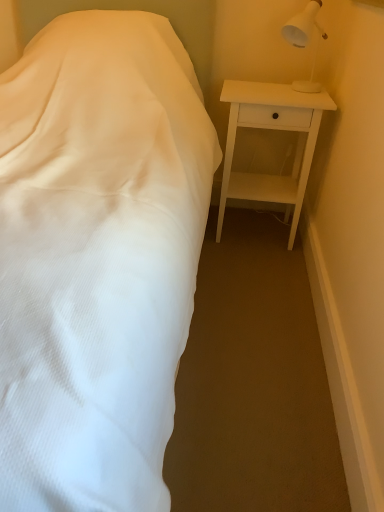
Question: Is white plastic lamp at upper right spatially inside white matte nightstand at right, or outside of it?

Choices:
 (A) outside
 (B) inside

Answer: (A)

Question: From a real-world perspective, relative to white matte nightstand at right, is white plastic lamp at upper right vertically above or below?

Choices:
 (A) above
 (B) below

Answer: (A)

Question: From the image's perspective, is white plastic lamp at upper right above or below white matte nightstand at right?

Choices:
 (A) above
 (B) below

Answer: (A)

Question: Considering the positions of white matte nightstand at right and white plastic lamp at upper right in the image, is white matte nightstand at right bigger or smaller than white plastic lamp at upper right?

Choices:
 (A) big
 (B) small

Answer: (A)

Question: From the image's perspective, is white matte nightstand at right located above or below white plastic lamp at upper right?

Choices:
 (A) below
 (B) above

Answer: (A)

Question: Would you say white matte nightstand at right is to the left or to the right of white plastic lamp at upper right in the picture?

Choices:
 (A) right
 (B) left

Answer: (B)

Question: Is white matte nightstand at right situated inside white plastic lamp at upper right or outside?

Choices:
 (A) inside
 (B) outside

Answer: (B)